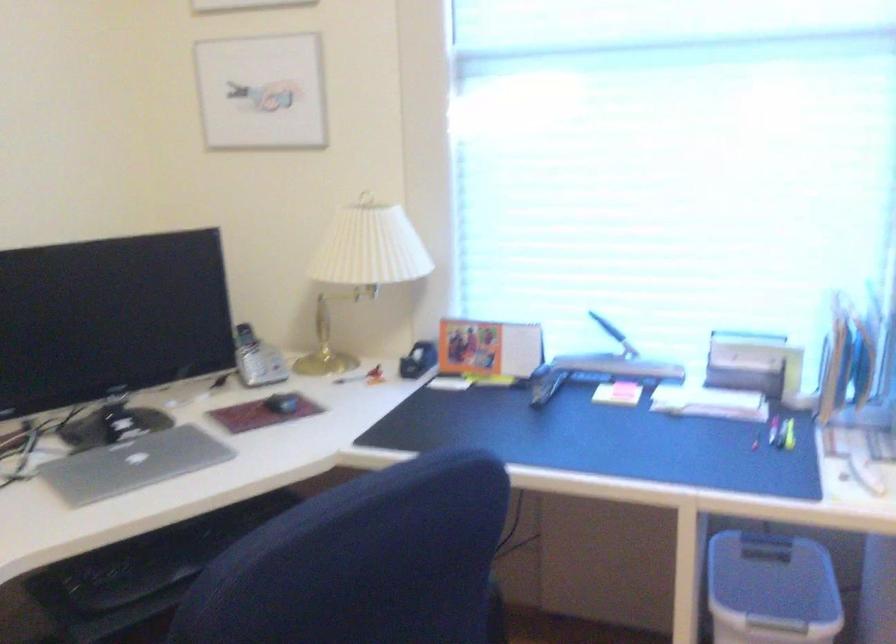
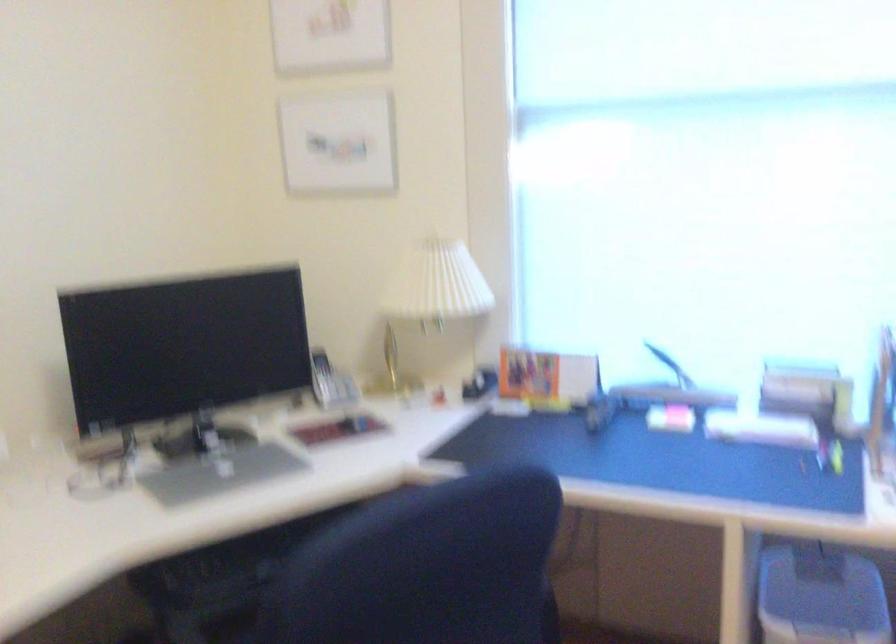
Question: The camera is either moving clockwise (left) or counter-clockwise (right) around the object. The first image is from the beginning of the video and the second image is from the end. Is the camera moving left or right when shooting the video?

Choices:
 (A) Left
 (B) Right

Answer: (B)